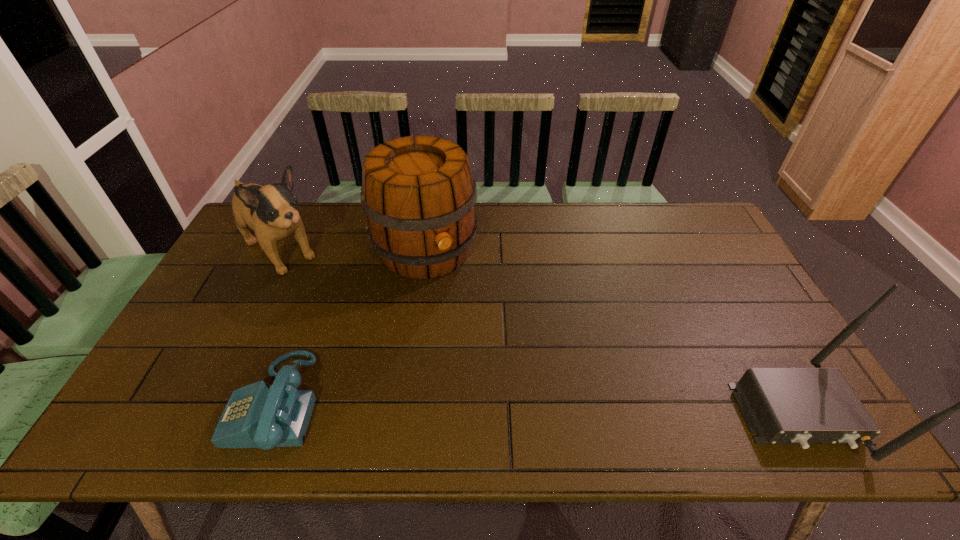
The width and height of the screenshot is (960, 540). I want to click on vacant spot on the desktop that is between the telephone and the router and is positioned on the side of the second object from right to left where the spigot is located, so click(x=523, y=407).

Where is `vacant space on the desktop that is between the shortest object and the router and is positioned at the face of the puppy`? Image resolution: width=960 pixels, height=540 pixels. vacant space on the desktop that is between the shortest object and the router and is positioned at the face of the puppy is located at coordinates (457, 406).